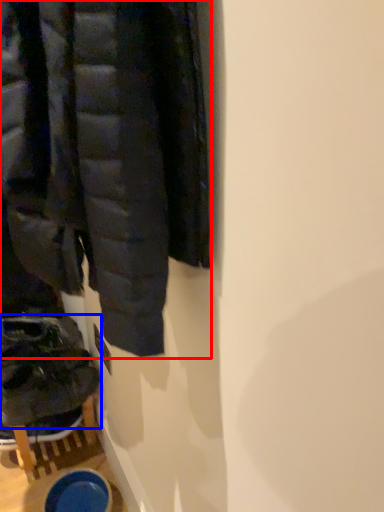
Question: Among these objects, which one is farthest to the camera, jacket (highlighted by a red box) or footwear (highlighted by a blue box)?

Choices:
 (A) jacket
 (B) footwear

Answer: (B)